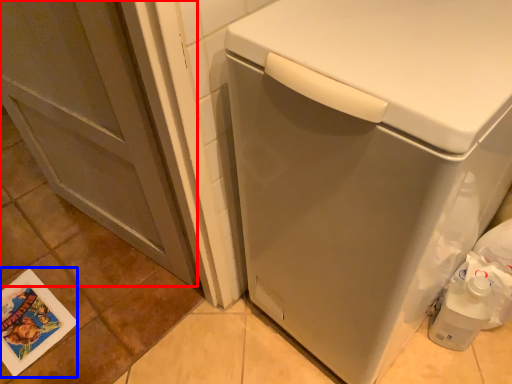
Question: Which point is closer to the camera, screen door (highlighted by a red box) or postcard (highlighted by a blue box)?

Choices:
 (A) screen door
 (B) postcard

Answer: (A)